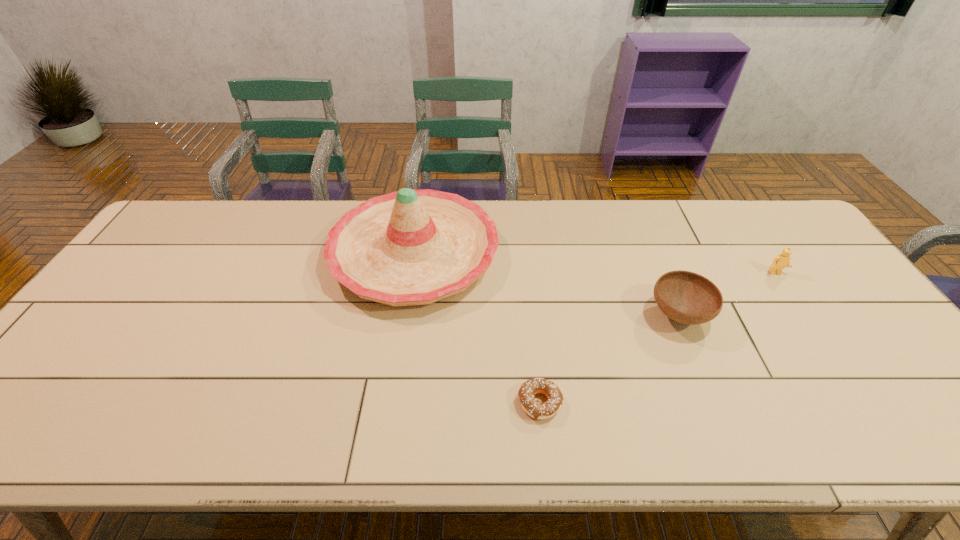
You are a GUI agent. You are given a task and a screenshot of the screen. Output one action in this format:
    pyautogui.click(x=<x>, y=<y>)
    Task: Click on the leftmost object
    This screenshot has width=960, height=540.
    Given the screenshot: What is the action you would take?
    pyautogui.click(x=411, y=247)

Locate an element on the screen. This screenshot has height=540, width=960. the tallest object is located at coordinates coord(411,247).

The image size is (960, 540). Identify the location of Lego. (782, 260).

Where is `bowl`? This screenshot has width=960, height=540. bowl is located at coordinates (686, 297).

At what (x,y) coordinates should I click in order to perform the action: click on the nearest object. Please return your answer as a coordinate pair (x, y). Image resolution: width=960 pixels, height=540 pixels. Looking at the image, I should click on 534,408.

You are a GUI agent. You are given a task and a screenshot of the screen. Output one action in this format:
    pyautogui.click(x=<x>, y=<y>)
    Task: Click on the doughnut
    
    Given the screenshot: What is the action you would take?
    pyautogui.click(x=534, y=408)

What are the coordinates of `vacant space positioned on the front of the sombrero` in the screenshot? It's located at point(387,428).

The height and width of the screenshot is (540, 960). I want to click on vacant space located 0.130m on the face of the rightmost object, so click(801, 310).

Locate an element on the screen. free space located on the right of the bowl is located at coordinates (761, 315).

I want to click on free location located on the back of the shortest object, so click(x=532, y=330).